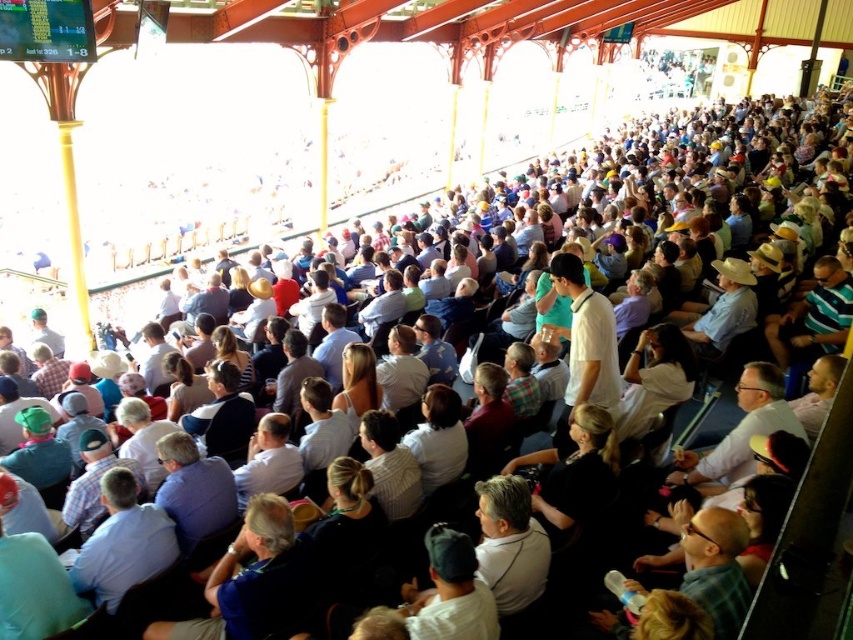
You are a photographer at the cricket match and want to capture a photo of the white shirt at center without the blue shirt at center blocking it. What should you do?

The blue shirt at center is in front of the white shirt at center, so you should move your position to the side to capture the white shirt at center without obstruction.

You are standing at the center of the field and want to throw a ball to a friend. There are two points marked in the stands where your friend might be sitting. The first point is at coordinate point (170, 531) and the second is at point (367, 448). Which point is closer to you so you can aim better?

Point (170, 531) is closer to the viewer than point (367, 448), so aim for that point.